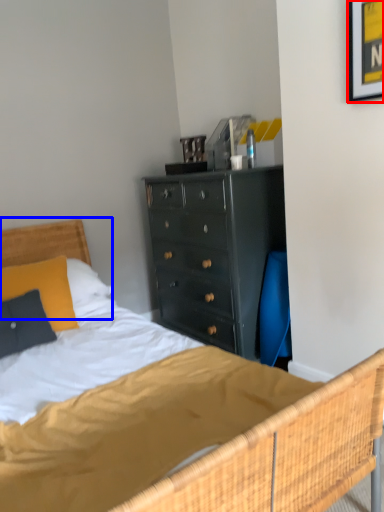
Question: Among these objects, which one is farthest to the camera, picture frame (highlighted by a red box) or headboard (highlighted by a blue box)?

Choices:
 (A) picture frame
 (B) headboard

Answer: (B)